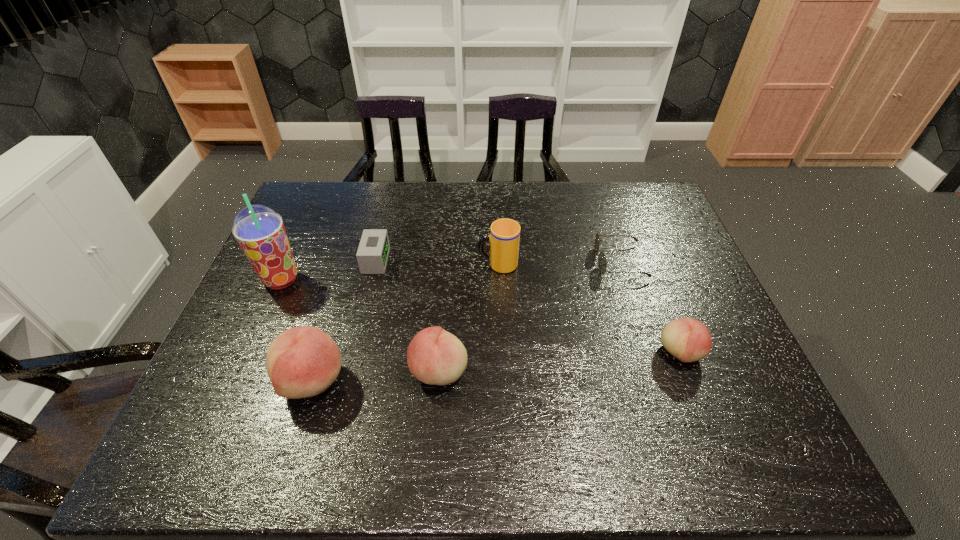
You are a GUI agent. You are given a task and a screenshot of the screen. Output one action in this format:
    pyautogui.click(x=<x>, y=<y>)
    Task: Click on the free space at the near left corner of the desktop
    The image size is (960, 540).
    Given the screenshot: What is the action you would take?
    pyautogui.click(x=266, y=390)

The height and width of the screenshot is (540, 960). In the image, there is a desktop. Find the location of `vacant area at the near right corner`. vacant area at the near right corner is located at coordinates (695, 393).

Image resolution: width=960 pixels, height=540 pixels. I want to click on free space between the second peach from left to right and the sunglasses, so click(x=529, y=316).

Locate an element on the screen. The width and height of the screenshot is (960, 540). vacant space that is in between the leftmost object and the cup is located at coordinates (390, 272).

The width and height of the screenshot is (960, 540). I want to click on vacant space that's between the tallest peach and the second tallest peach, so click(x=375, y=375).

At what (x,y) coordinates should I click in order to perform the action: click on vacant area between the fourth shortest object and the sunglasses. Please return your answer as a coordinate pair (x, y). This screenshot has width=960, height=540. Looking at the image, I should click on (529, 316).

Locate an element on the screen. free space between the fifth object from left to right and the tallest object is located at coordinates (390, 272).

This screenshot has width=960, height=540. What are the coordinates of `vacant space that's between the alarm clock and the leftmost peach` in the screenshot? It's located at (344, 320).

Where is `unoccupied position between the sunglasses and the second peach from right to left`? unoccupied position between the sunglasses and the second peach from right to left is located at coordinates (529, 316).

The image size is (960, 540). I want to click on vacant point located between the third object from right to left and the rightmost peach, so click(x=588, y=308).